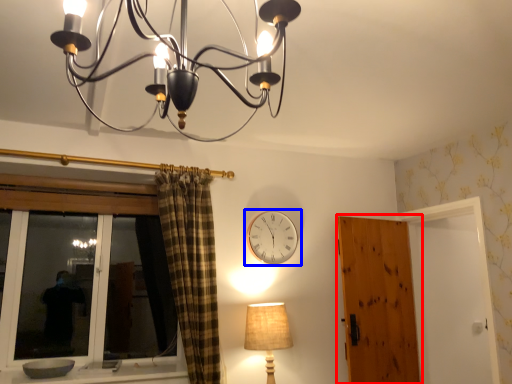
Question: Which of the following is the closest to the observer, door (highlighted by a red box) or wall clock (highlighted by a blue box)?

Choices:
 (A) door
 (B) wall clock

Answer: (A)